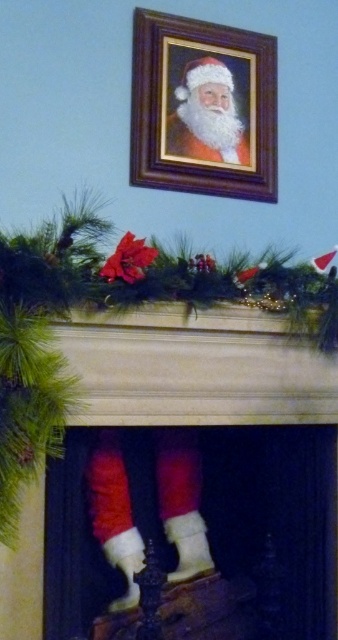
You are a child who wants to place a 30 inch long candy cane between the velvet red stocking at lower center and the white fluffy santa at upper center. Can you fit the candy cane horizontally between them without bending it?

The distance between the velvet red stocking at lower center and the white fluffy santa at upper center is 29.89 inches, which is slightly less than the candy cane length of 30 inches. Therefore, the candy cane cannot be placed horizontally between them without bending it.